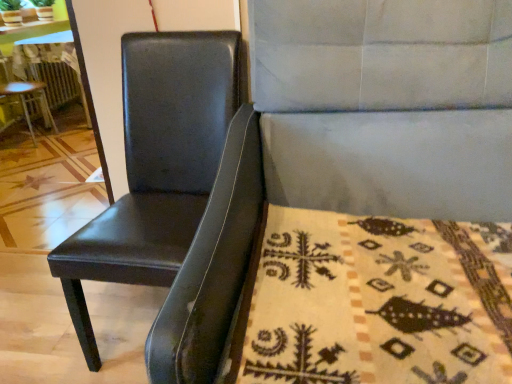
Identify the location of black leather chair at left, the 3th chair from the back. (347, 141).

Describe the element at coordinates (51, 65) in the screenshot. I see `wooden table at left` at that location.

Find the location of a particular element. Image resolution: width=512 pixels, height=384 pixels. wooden table at left is located at coordinates (51, 65).

Where is `matte black chair at left, the 2th chair in the back-to-front sequence`? The width and height of the screenshot is (512, 384). matte black chair at left, the 2th chair in the back-to-front sequence is located at coordinates (156, 166).

The width and height of the screenshot is (512, 384). What do you see at coordinates (156, 166) in the screenshot?
I see `matte black chair at left, the 2th chair in the back-to-front sequence` at bounding box center [156, 166].

Describe the element at coordinates (376, 301) in the screenshot. The width and height of the screenshot is (512, 384). I see `beige woolen blanket at lower right` at that location.

What is the approximate height of beige woolen blanket at lower right?

beige woolen blanket at lower right is 5.79 inches in height.

Where is `black leather chair at left, acting as the 1th chair starting from the front`? Image resolution: width=512 pixels, height=384 pixels. black leather chair at left, acting as the 1th chair starting from the front is located at coordinates (347, 141).

Considering the sizes of objects matte black chair at left, the 2th chair viewed from the left, and black leather chair at left, acting as the first chair starting from the right, in the image provided, who is shorter, matte black chair at left, the 2th chair viewed from the left, or black leather chair at left, acting as the first chair starting from the right,?

With less height is matte black chair at left, the 2th chair viewed from the left.

Consider the image. What's the angular difference between matte black chair at left, the 2th chair viewed from the right, and black leather chair at left, acting as the first chair starting from the right,'s facing directions?

The angular difference between matte black chair at left, the 2th chair viewed from the right, and black leather chair at left, acting as the first chair starting from the right, is 4.1 degrees.

The image size is (512, 384). In order to click on chair located above the matte black chair at left, the 2th chair viewed from the right (from a real-world perspective) in this screenshot , I will do `click(347, 141)`.

Considering the sizes of wooden table at left and beige woolen blanket at lower right in the image, is wooden table at left wider or thinner than beige woolen blanket at lower right?

Considering their sizes, wooden table at left looks slimmer than beige woolen blanket at lower right.

Is wooden table at left at the right side of beige woolen blanket at lower right?

No, wooden table at left is not to the right of beige woolen blanket at lower right.

Considering the sizes of objects wooden table at left and beige woolen blanket at lower right in the image provided, who is bigger, wooden table at left or beige woolen blanket at lower right?

wooden table at left.

The image size is (512, 384). I want to click on blanket in front of the wooden table at left, so click(x=376, y=301).

Which of these two, black leather chair at left, the 1th chair positioned from the left, or beige woolen blanket at lower right, is thinner?

black leather chair at left, the 1th chair positioned from the left, is thinner.

Considering their positions, is black leather chair at left, the first chair viewed from the back, located in front of or behind beige woolen blanket at lower right?

In the image, black leather chair at left, the first chair viewed from the back, appears behind beige woolen blanket at lower right.

Based on the photo, who is taller, black leather chair at left, the first chair viewed from the back, or beige woolen blanket at lower right?

Standing taller between the two is black leather chair at left, the first chair viewed from the back.

From the image's perspective, is black leather chair at left, which is the 3th chair from front to back, on beige woolen blanket at lower right?

Indeed, from the image's perspective, black leather chair at left, which is the 3th chair from front to back, is shown above beige woolen blanket at lower right.

Is black leather chair at left, acting as the third chair starting from the left, taller than matte black chair at left, positioned as the second chair in front-to-back order?

Correct, black leather chair at left, acting as the third chair starting from the left, is much taller as matte black chair at left, positioned as the second chair in front-to-back order.

Is black leather chair at left, acting as the first chair starting from the right, wider than matte black chair at left, the 2th chair viewed from the right?

Yes.

In the image, is black leather chair at left, acting as the 1th chair starting from the front, positioned in front of or behind matte black chair at left, the 2th chair viewed from the right?

black leather chair at left, acting as the 1th chair starting from the front, is in front of matte black chair at left, the 2th chair viewed from the right.

Is there a large distance between beige woolen blanket at lower right and wooden table at left?

Yes, beige woolen blanket at lower right and wooden table at left are located far from each other.

Between beige woolen blanket at lower right and wooden table at left, which one is positioned behind?

wooden table at left is further from the camera.

Based on the photo, is beige woolen blanket at lower right oriented away from wooden table at left?

No, wooden table at left is not at the back of beige woolen blanket at lower right.

Is beige woolen blanket at lower right not inside wooden table at left?

Yes, beige woolen blanket at lower right is located beyond the bounds of wooden table at left.

Does black leather chair at left, acting as the 1th chair starting from the front, appear on the left side of black leather chair at left, which is the 3th chair from front to back?

In fact, black leather chair at left, acting as the 1th chair starting from the front, is to the right of black leather chair at left, which is the 3th chair from front to back.

From the black leather chair at left, which is counted as the 3th chair, starting from the right, count 2nd chairs forward and point to it. Please provide its 2D coordinates.

[(347, 141)]

Is black leather chair at left, acting as the 1th chair starting from the front, inside the boundaries of black leather chair at left, which is the 3th chair from front to back, or outside?

black leather chair at left, acting as the 1th chair starting from the front, cannot be found inside black leather chair at left, which is the 3th chair from front to back.

Does black leather chair at left, the 3th chair from the back, have a lesser width compared to black leather chair at left, which is counted as the 3th chair, starting from the right?

Incorrect, the width of black leather chair at left, the 3th chair from the back, is not less than that of black leather chair at left, which is counted as the 3th chair, starting from the right.

Are wooden table at left and black leather chair at left, acting as the 1th chair starting from the front, far apart?

Indeed, wooden table at left is not near black leather chair at left, acting as the 1th chair starting from the front.

Is wooden table at left looking in the opposite direction of black leather chair at left, acting as the first chair starting from the right?

No, wooden table at left is not facing away from black leather chair at left, acting as the first chair starting from the right.

Does wooden table at left come behind black leather chair at left, acting as the first chair starting from the right?

Yes, wooden table at left is further from the viewer.

What are the coordinates of `the 1st chair above when counting from the black leather chair at left, the 3th chair from the back (from the image's perspective)` in the screenshot? It's located at (156, 166).

Find the location of `blanket below the wooden table at left (from the image's perspective)`. blanket below the wooden table at left (from the image's perspective) is located at coordinates (376, 301).

Based on their spatial positions, is beige woolen blanket at lower right or wooden table at left further from matte black chair at left, positioned as the second chair in front-to-back order?

wooden table at left is further to matte black chair at left, positioned as the second chair in front-to-back order.

Which object lies nearer to the anchor point black leather chair at left, which is counted as the 3th chair, starting from the right, beige woolen blanket at lower right or matte black chair at left, the 2th chair in the back-to-front sequence?

Among the two, matte black chair at left, the 2th chair in the back-to-front sequence, is located nearer to black leather chair at left, which is counted as the 3th chair, starting from the right.

Considering their positions, is beige woolen blanket at lower right positioned further to black leather chair at left, acting as the 1th chair starting from the front, than wooden table at left?

wooden table at left lies further to black leather chair at left, acting as the 1th chair starting from the front, than the other object.

When comparing their distances from black leather chair at left, acting as the third chair starting from the left, does matte black chair at left, the 2th chair viewed from the right, or black leather chair at left, which is counted as the 3th chair, starting from the right, seem further?

Based on the image, black leather chair at left, which is counted as the 3th chair, starting from the right, appears to be further to black leather chair at left, acting as the third chair starting from the left.

Looking at the image, which one is located further to matte black chair at left, the 2th chair viewed from the right, black leather chair at left, acting as the first chair starting from the right, or black leather chair at left, which is counted as the 3th chair, starting from the right?

Based on the image, black leather chair at left, which is counted as the 3th chair, starting from the right, appears to be further to matte black chair at left, the 2th chair viewed from the right.

When comparing their distances from beige woolen blanket at lower right, does matte black chair at left, the 2th chair in the back-to-front sequence, or wooden table at left seem further?

wooden table at left lies further to beige woolen blanket at lower right than the other object.

When comparing their distances from matte black chair at left, the 2th chair viewed from the right, does black leather chair at left, which is the 3th chair from front to back, or beige woolen blanket at lower right seem further?

The object further to matte black chair at left, the 2th chair viewed from the right, is black leather chair at left, which is the 3th chair from front to back.

Considering their positions, is beige woolen blanket at lower right positioned further to matte black chair at left, the 2th chair viewed from the left, than black leather chair at left, the first chair viewed from the back?

black leather chair at left, the first chair viewed from the back, lies further to matte black chair at left, the 2th chair viewed from the left, than the other object.

Find the location of `blanket between black leather chair at left, acting as the third chair starting from the left, and wooden table at left, along the z-axis`. blanket between black leather chair at left, acting as the third chair starting from the left, and wooden table at left, along the z-axis is located at coordinates (376, 301).

Find the location of a particular element. The image size is (512, 384). chair between matte black chair at left, positioned as the second chair in front-to-back order, and wooden table at left, along the z-axis is located at coordinates (30, 101).

The height and width of the screenshot is (384, 512). I want to click on blanket between matte black chair at left, the 2th chair viewed from the right, and black leather chair at left, acting as the third chair starting from the left, in the horizontal direction, so click(376, 301).

Where is `chair between black leather chair at left, the 3th chair from the back, and black leather chair at left, which is the 3th chair from front to back, along the z-axis`? chair between black leather chair at left, the 3th chair from the back, and black leather chair at left, which is the 3th chair from front to back, along the z-axis is located at coordinates (156, 166).